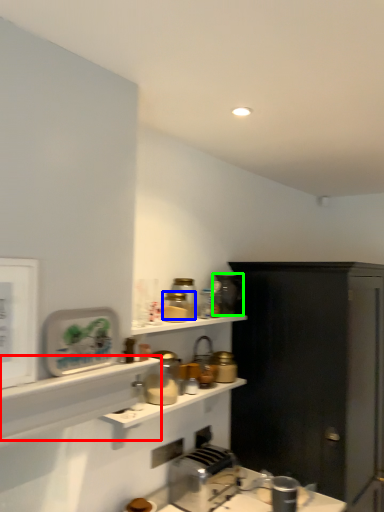
Question: Which object is the closest to the shelf (highlighted by a red box)? Choose among these: appliance (highlighted by a blue box) or appliance (highlighted by a green box).

Choices:
 (A) appliance
 (B) appliance

Answer: (A)